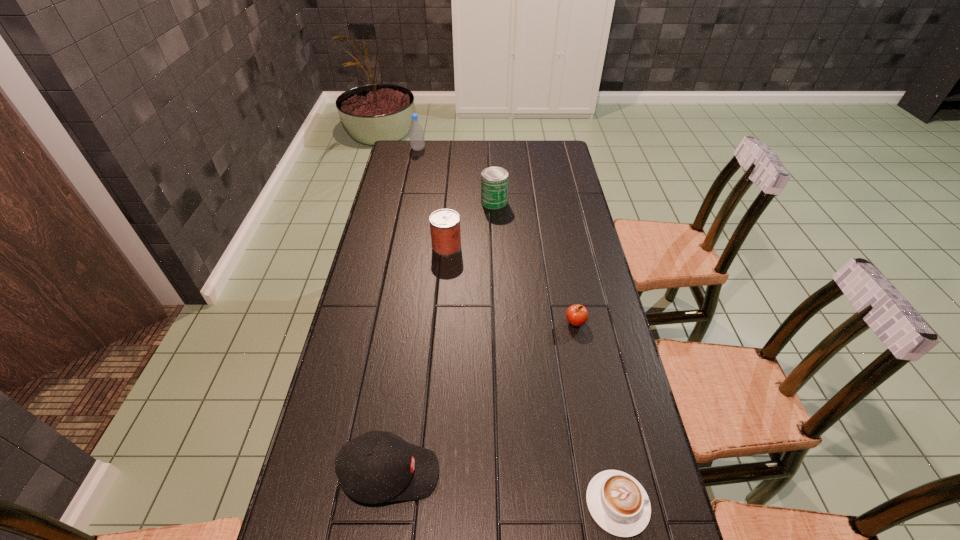
At what (x,y) coordinates should I click in order to perform the action: click on free spot that satisfies the following two spatial constraints: 1. on the front side of the left can; 2. on the left side of the second shortest object. Please return your answer as a coordinate pair (x, y). This screenshot has height=540, width=960. Looking at the image, I should click on (441, 322).